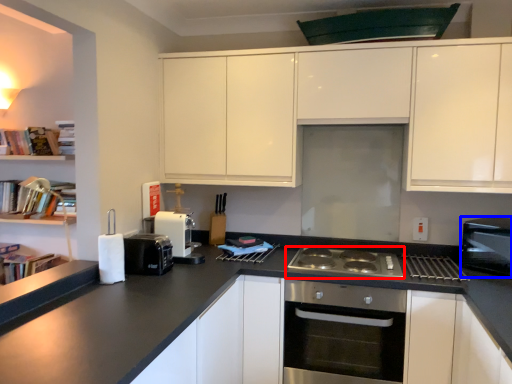
Question: Which object appears closest to the camera in this image, gas stove (highlighted by a red box) or kitchen appliance (highlighted by a blue box)?

Choices:
 (A) gas stove
 (B) kitchen appliance

Answer: (B)